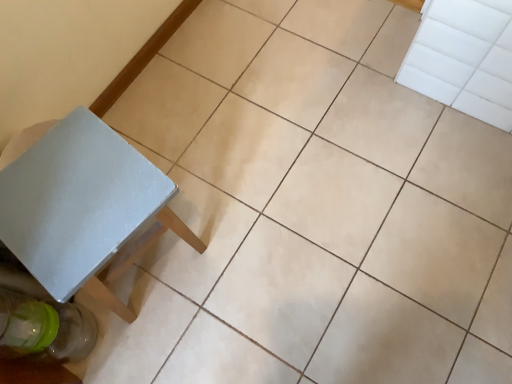
Question: Can you confirm if transparent glass bottle at lower left is shorter than white matte table at lower left?

Choices:
 (A) yes
 (B) no

Answer: (A)

Question: From a real-world perspective, is transparent glass bottle at lower left on top of white matte table at lower left?

Choices:
 (A) no
 (B) yes

Answer: (A)

Question: Does transparent glass bottle at lower left have a smaller size compared to white matte table at lower left?

Choices:
 (A) yes
 (B) no

Answer: (A)

Question: Is transparent glass bottle at lower left next to white matte table at lower left?

Choices:
 (A) yes
 (B) no

Answer: (B)

Question: Is transparent glass bottle at lower left taller than white matte table at lower left?

Choices:
 (A) no
 (B) yes

Answer: (A)

Question: Is transparent glass bottle at lower left further to the viewer compared to white matte table at lower left?

Choices:
 (A) yes
 (B) no

Answer: (A)

Question: Is white matte table at lower left further to camera compared to transparent glass bottle at lower left?

Choices:
 (A) no
 (B) yes

Answer: (A)

Question: Is white matte table at lower left wider than transparent glass bottle at lower left?

Choices:
 (A) yes
 (B) no

Answer: (A)

Question: Is transparent glass bottle at lower left at the back of white matte table at lower left?

Choices:
 (A) yes
 (B) no

Answer: (B)

Question: Is white matte table at lower left bigger than transparent glass bottle at lower left?

Choices:
 (A) no
 (B) yes

Answer: (B)

Question: Considering the relative sizes of white matte table at lower left and transparent glass bottle at lower left in the image provided, is white matte table at lower left thinner than transparent glass bottle at lower left?

Choices:
 (A) yes
 (B) no

Answer: (B)

Question: Is white matte table at lower left at the right side of transparent glass bottle at lower left?

Choices:
 (A) yes
 (B) no

Answer: (A)

Question: From a real-world perspective, is transparent glass bottle at lower left above or below white matte table at lower left?

Choices:
 (A) below
 (B) above

Answer: (A)